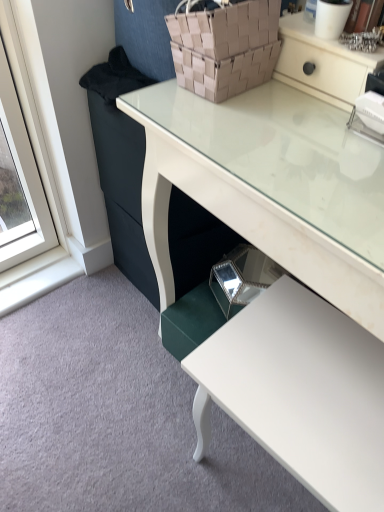
This screenshot has height=512, width=384. In order to click on free space in front of brown woven basket at upper center in this screenshot , I will do `click(231, 126)`.